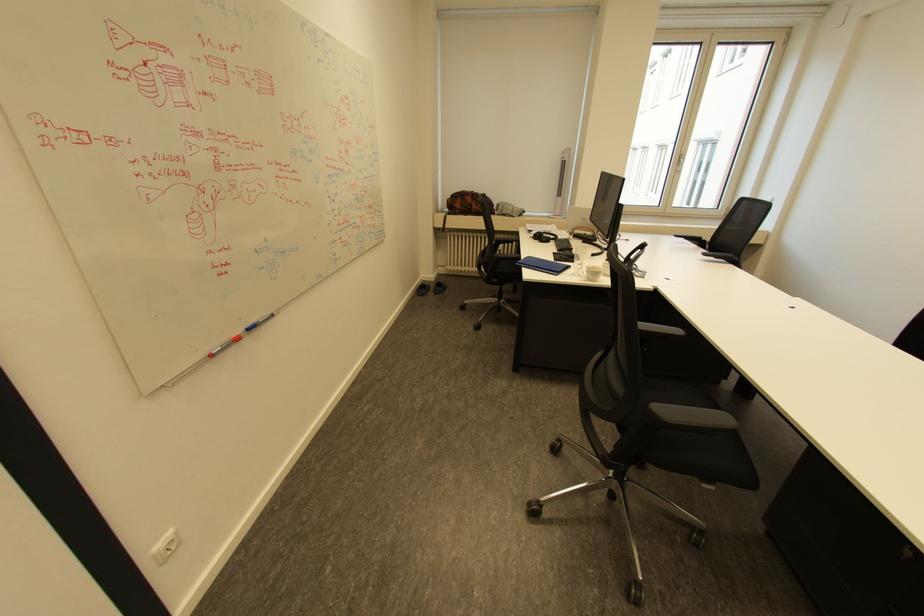
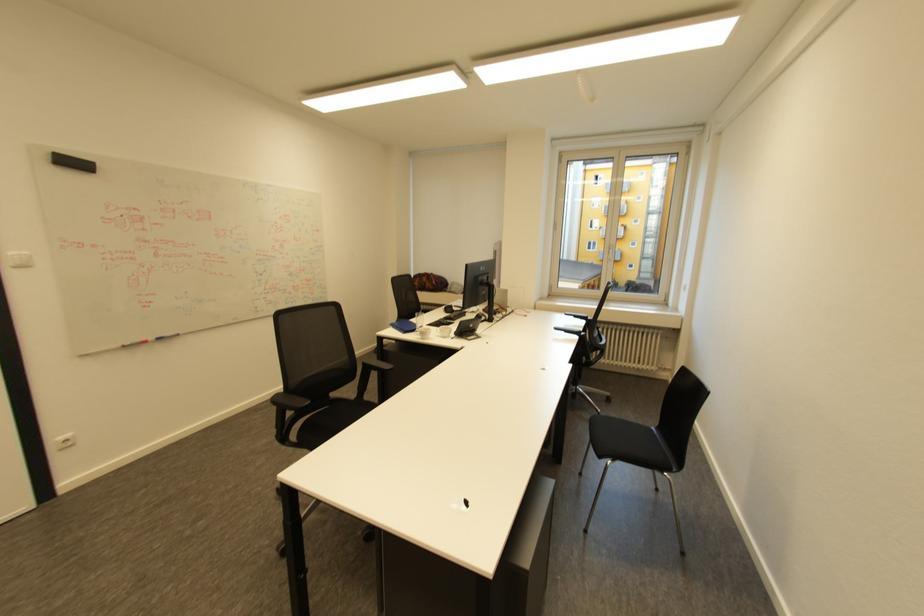
Where in the second image is the point corresponding to point (217, 355) from the first image?

(128, 346)